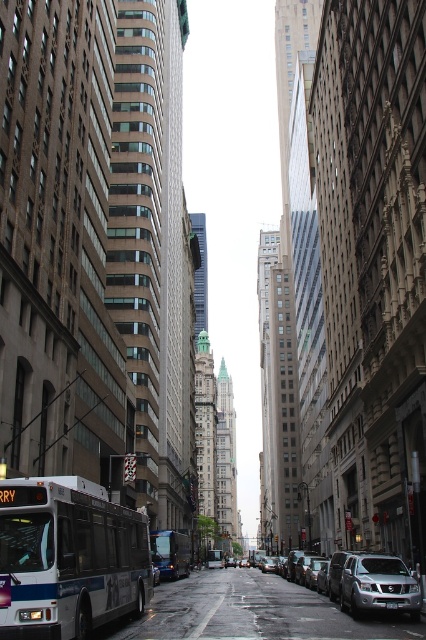
Question: Can you confirm if silver metallic suv at lower right is thinner than white metallic bus at center?

Choices:
 (A) yes
 (B) no

Answer: (B)

Question: Which point is closer to the camera taking this photo?

Choices:
 (A) (337, 593)
 (B) (219, 550)
 (C) (0, 632)

Answer: (C)

Question: Is silver metallic suv at lower right bigger than white metallic bus at center?

Choices:
 (A) no
 (B) yes

Answer: (A)

Question: Does white metallic bus at lower left come behind blue metallic bus at center?

Choices:
 (A) no
 (B) yes

Answer: (A)

Question: Estimate the real-world distances between objects in this image. Which object is closer to the white metallic bus at lower left?

Choices:
 (A) blue metallic bus at center
 (B) white metallic bus at center
 (C) silver metallic suv at lower right

Answer: (C)

Question: Which point is closer to the camera taking this photo?

Choices:
 (A) (164, 540)
 (B) (393, 588)

Answer: (B)